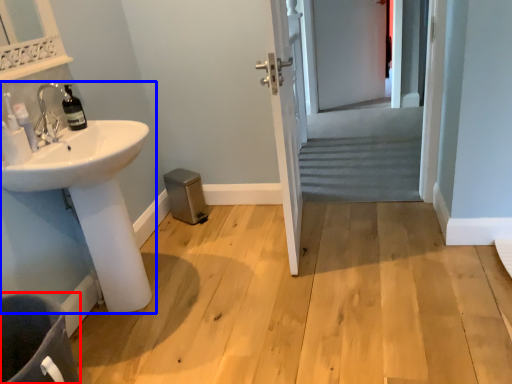
Question: Among these objects, which one is nearest to the camera, toilet bowl (highlighted by a red box) or sink (highlighted by a blue box)?

Choices:
 (A) toilet bowl
 (B) sink

Answer: (A)